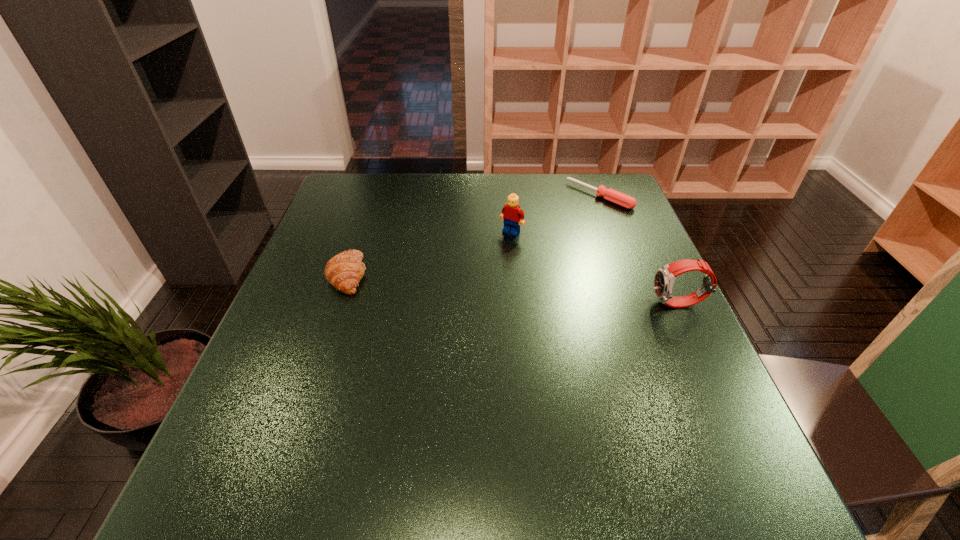
This screenshot has height=540, width=960. I want to click on vacant space on the desktop that is between the second shortest object and the watch and is positioned at the tip of the screwdriver, so click(478, 286).

Locate an element on the screen. The height and width of the screenshot is (540, 960). free spot on the desktop that is between the crescent roll and the watch and is positioned on the front-facing side of the third nearest object is located at coordinates (466, 285).